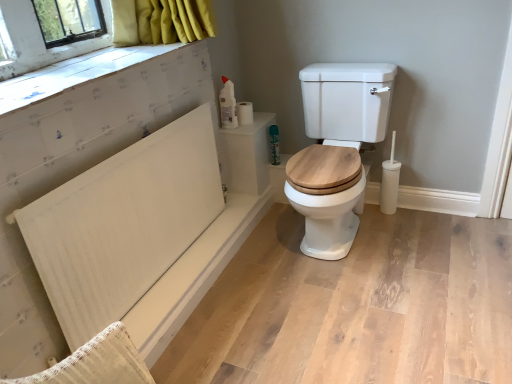
Question: Does white matte bath at lower left have a smaller size compared to green matte spray can at upper right?

Choices:
 (A) no
 (B) yes

Answer: (A)

Question: From a real-world perspective, is white matte bath at lower left physically above green matte spray can at upper right?

Choices:
 (A) no
 (B) yes

Answer: (A)

Question: Is white matte bath at lower left oriented away from green matte spray can at upper right?

Choices:
 (A) no
 (B) yes

Answer: (A)

Question: Is white matte bath at lower left bigger than green matte spray can at upper right?

Choices:
 (A) yes
 (B) no

Answer: (A)

Question: From the image's perspective, is white matte bath at lower left located above green matte spray can at upper right?

Choices:
 (A) no
 (B) yes

Answer: (A)

Question: Is white wood toilet at center in front of or behind white textured board at upper left in the image?

Choices:
 (A) behind
 (B) front

Answer: (A)

Question: Would you say white wood toilet at center is inside or outside white textured board at upper left?

Choices:
 (A) outside
 (B) inside

Answer: (A)

Question: From the image's perspective, relative to white textured board at upper left, is white wood toilet at center above or below?

Choices:
 (A) above
 (B) below

Answer: (B)

Question: Is point (311, 228) positioned closer to the camera than point (6, 81)?

Choices:
 (A) closer
 (B) farther

Answer: (B)

Question: In terms of width, does green matte spray can at upper right look wider or thinner when compared to white matte bath at lower left?

Choices:
 (A) wide
 (B) thin

Answer: (A)

Question: Would you say green matte spray can at upper right is to the left or to the right of white matte bath at lower left in the picture?

Choices:
 (A) left
 (B) right

Answer: (B)

Question: Would you say green matte spray can at upper right is inside or outside white matte bath at lower left?

Choices:
 (A) outside
 (B) inside

Answer: (A)

Question: From a real-world perspective, is green matte spray can at upper right physically located above or below white matte bath at lower left?

Choices:
 (A) below
 (B) above

Answer: (B)

Question: Which is correct: white matte toilet paper at upper right, the 1th toilet paper viewed from the right, is inside white matte toilet paper at upper right, arranged as the second toilet paper when viewed from the right, or outside of it?

Choices:
 (A) outside
 (B) inside

Answer: (A)

Question: From the image's perspective, is white matte toilet paper at upper right, which ranks as the second toilet paper in left-to-right order, positioned above or below white matte toilet paper at upper right, acting as the 1th toilet paper starting from the left?

Choices:
 (A) above
 (B) below

Answer: (B)